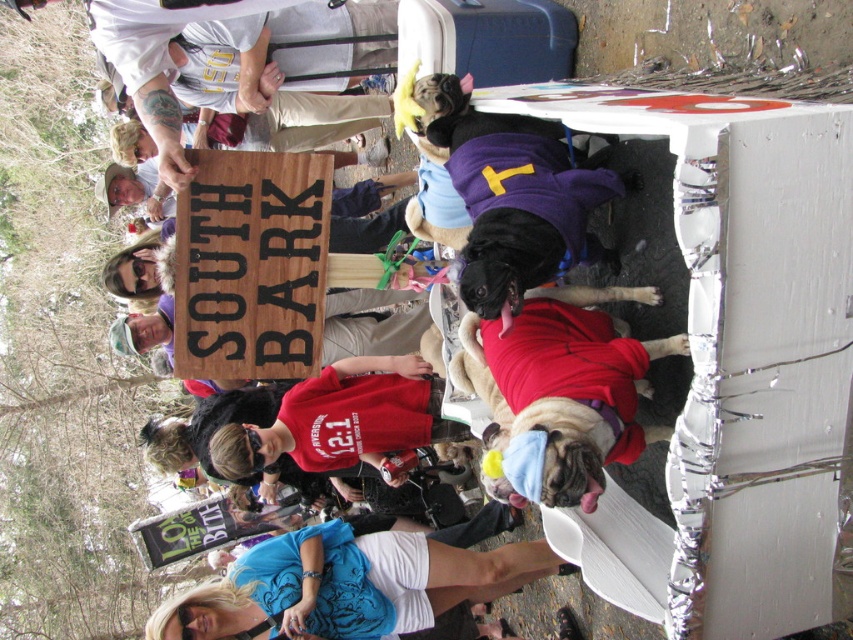
Question: Is blue cotton shirt at lower center smaller than red fabric dog at center?

Choices:
 (A) yes
 (B) no

Answer: (B)

Question: Which object is positioned farthest from the red fabric dog at center?

Choices:
 (A) wooden sign at center
 (B) blue cotton shirt at lower center

Answer: (B)

Question: Considering the relative positions of wooden sign at center and blue cotton shirt at lower center in the image provided, where is wooden sign at center located with respect to blue cotton shirt at lower center?

Choices:
 (A) left
 (B) right

Answer: (A)

Question: Which object is farther from the camera taking this photo?

Choices:
 (A) red fabric dog at center
 (B) blue cotton shirt at lower center
 (C) wooden sign at center

Answer: (B)

Question: Can you confirm if wooden sign at center is positioned above red fabric dog at center?

Choices:
 (A) no
 (B) yes

Answer: (B)

Question: Among these points, which one is farthest from the camera?

Choices:
 (A) (253, 298)
 (B) (497, 573)

Answer: (B)